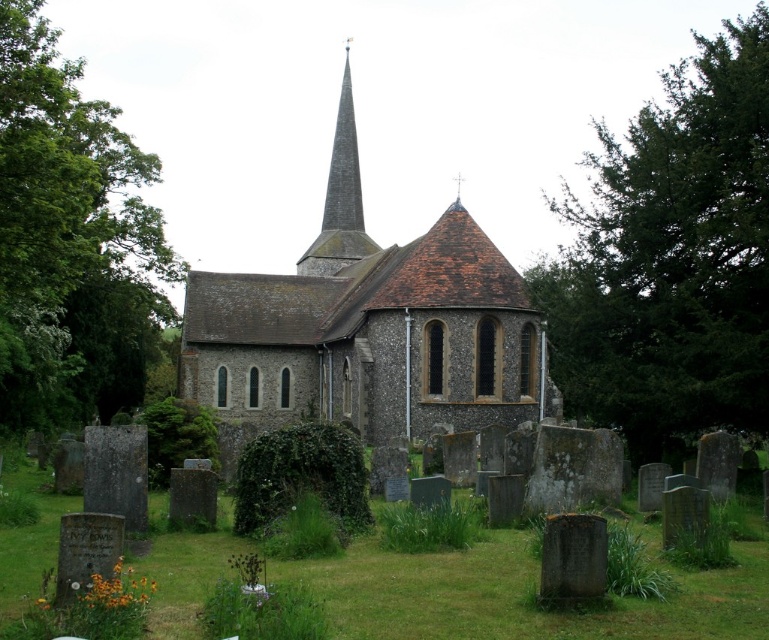
Which is behind, point (308, 264) or point (325, 209)?

Positioned behind is point (325, 209).

This screenshot has width=769, height=640. I want to click on gray stone steeple at upper center, so click(x=340, y=196).

Who is more distant from viewer, (311, 243) or (343, 138)?

The point (311, 243) is behind.

You are a GUI agent. You are given a task and a screenshot of the screen. Output one action in this format:
    pyautogui.click(x=<x>, y=<y>)
    Task: Click on the gray stone steeple at upper center
    
    Given the screenshot: What is the action you would take?
    pyautogui.click(x=340, y=196)

Between brown stone church at center and brown stone spire at center, which one has more height?

Standing taller between the two is brown stone church at center.

Find the location of a particular element. The height and width of the screenshot is (640, 769). brown stone church at center is located at coordinates (370, 326).

Does point (288, 298) come behind point (72, 136)?

That is True.

Does brown stone church at center appear over green leafy tree at center?

Incorrect, brown stone church at center is not positioned above green leafy tree at center.

Is point (215, 307) more distant than point (145, 298)?

Yes, it is behind point (145, 298).

Identify the location of brown stone church at center. (370, 326).